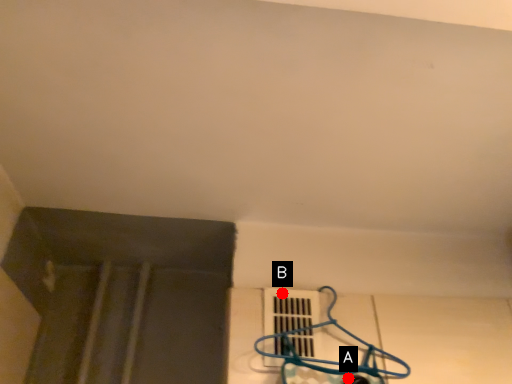
Question: Two points are circled on the image, labeled by A and B beside each circle. Which of the following is the closest to the observer?

Choices:
 (A) A is closer
 (B) B is closer

Answer: (A)